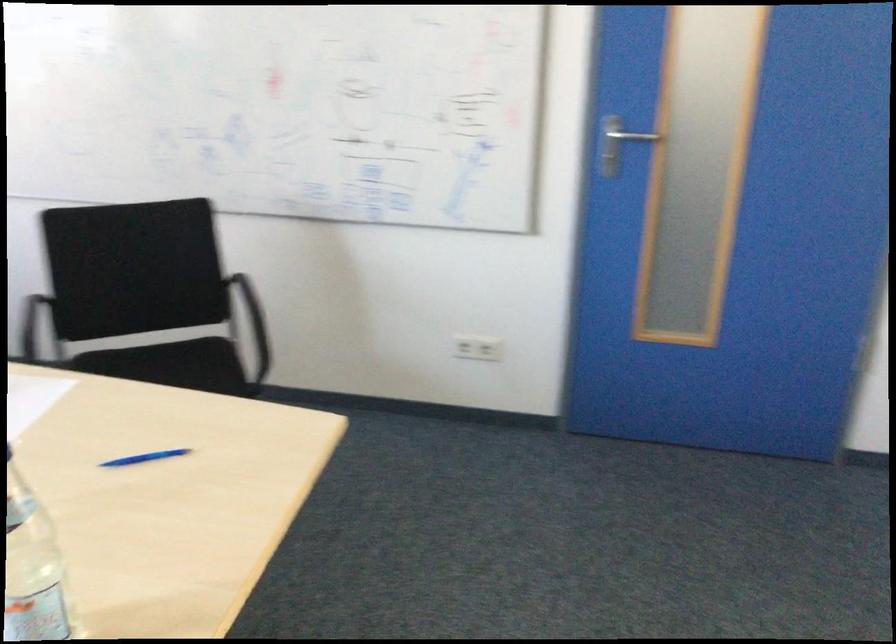
This screenshot has height=644, width=896. I want to click on white power socket, so 476,348.